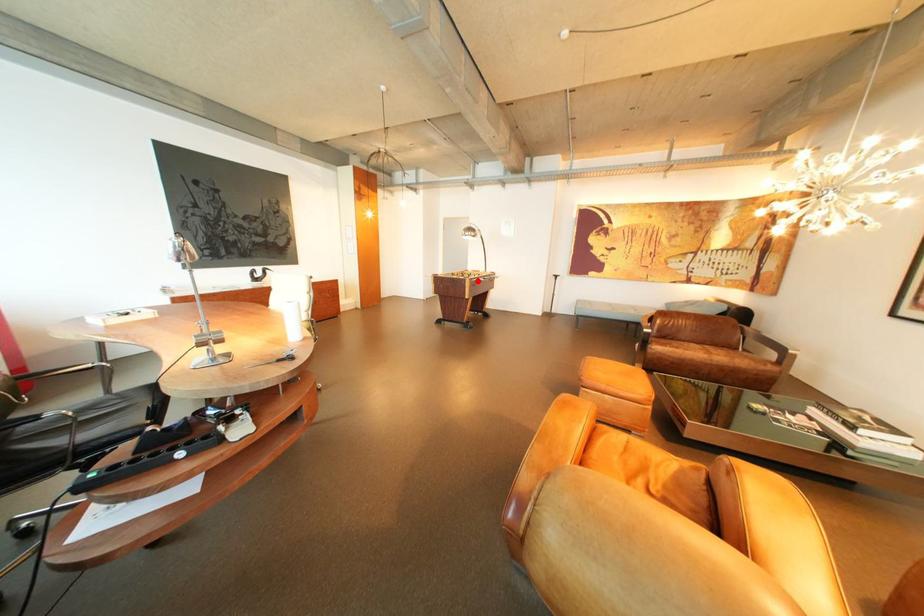
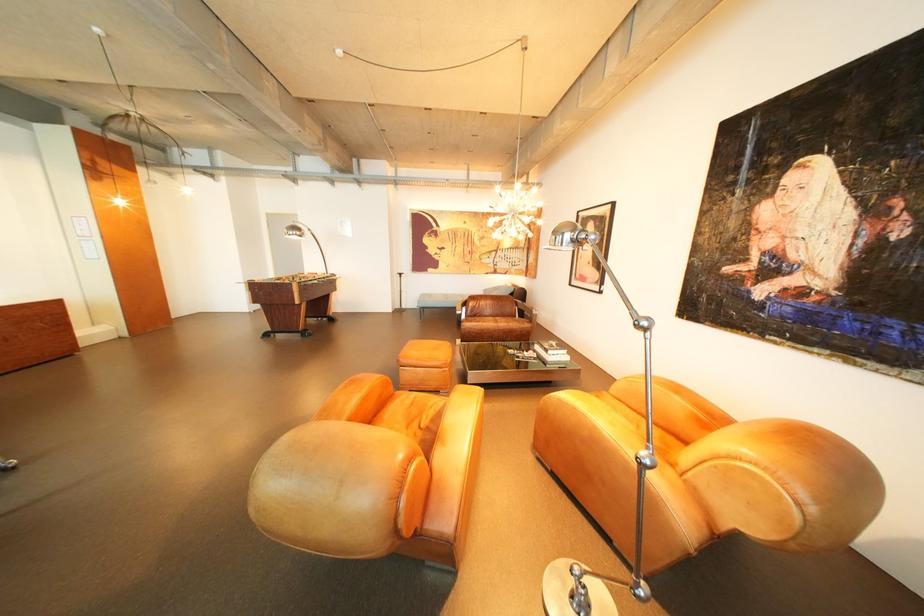
Find the pixel in the second image that matches the highlighted location in the first image.

(304, 285)